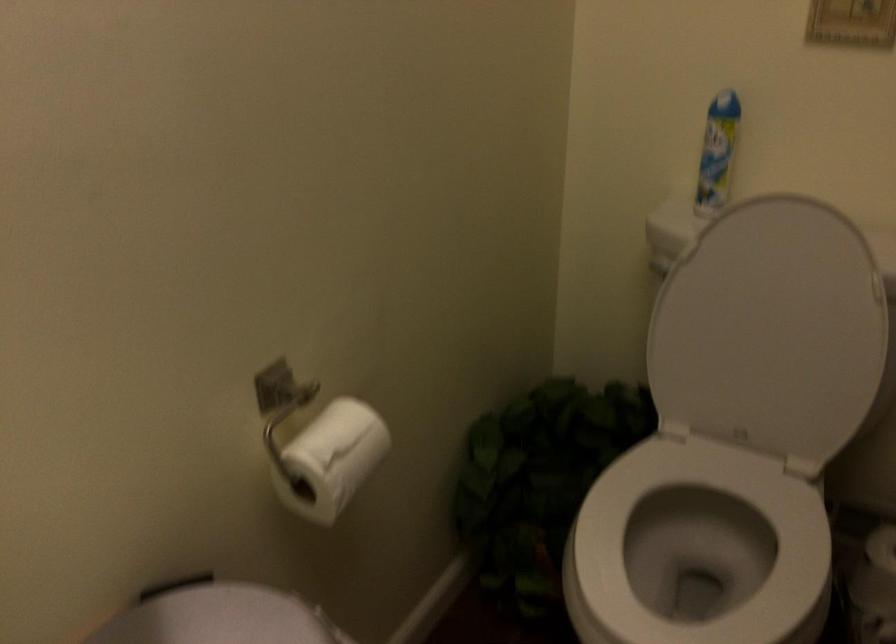
This screenshot has height=644, width=896. Find the location of `white toilet seat`. white toilet seat is located at coordinates (698, 547).